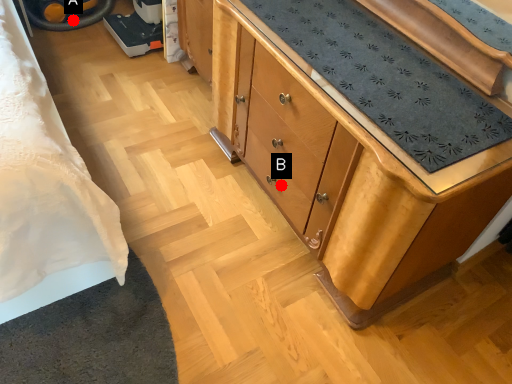
Question: Two points are circled on the image, labeled by A and B beside each circle. Which point appears farthest from the camera in this image?

Choices:
 (A) A is further
 (B) B is further

Answer: (A)